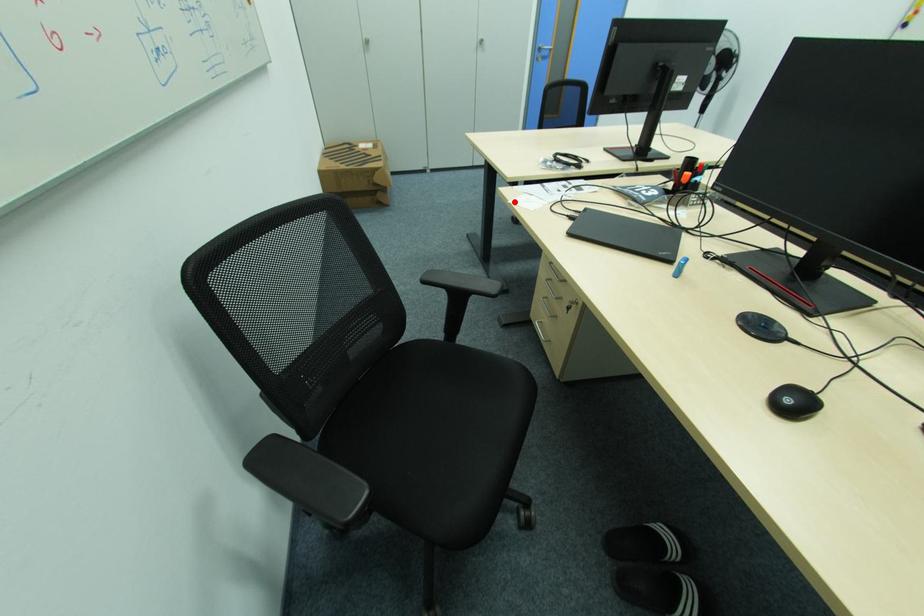
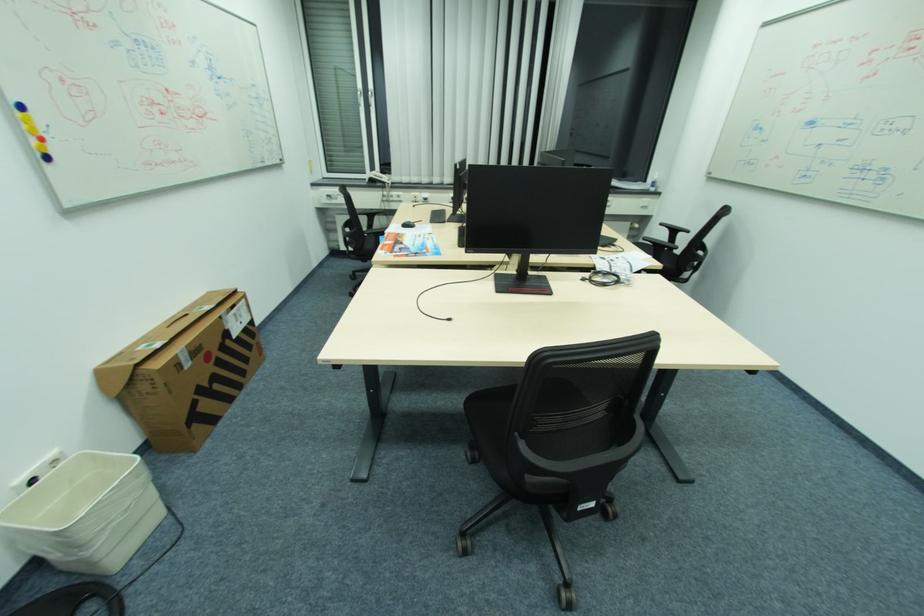
Where in the second image is the point corresponding to the highlighted location from the first image?

(657, 257)